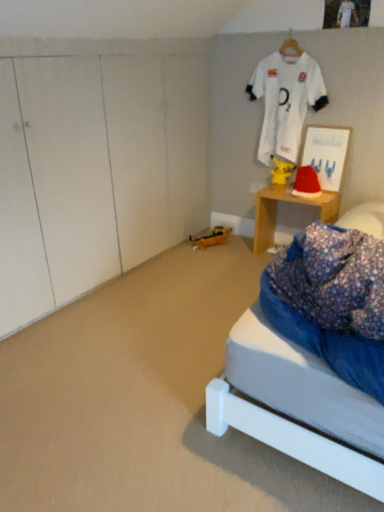
Question: From the image's perspective, is red velvet santa hat at right above or below yellow matte pikachu at center?

Choices:
 (A) below
 (B) above

Answer: (A)

Question: Considering the positions of red velvet santa hat at right and yellow matte pikachu at center in the image, is red velvet santa hat at right taller or shorter than yellow matte pikachu at center?

Choices:
 (A) tall
 (B) short

Answer: (B)

Question: Which of these objects is positioned closest to the wooden desk at right?

Choices:
 (A) red velvet santa hat at right
 (B) matte white picture frame at upper right
 (C) white jersey at upper center
 (D) yellow matte pikachu at center

Answer: (A)

Question: Which is nearer to the wooden desk at right?

Choices:
 (A) white jersey at upper center
 (B) matte white picture frame at upper right
 (C) yellow matte pikachu at center
 (D) red velvet santa hat at right

Answer: (D)